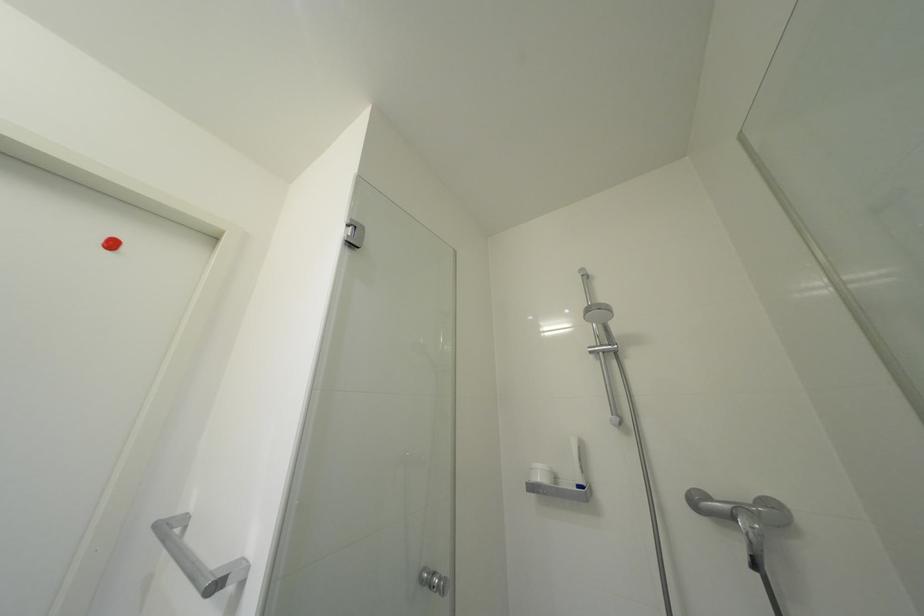
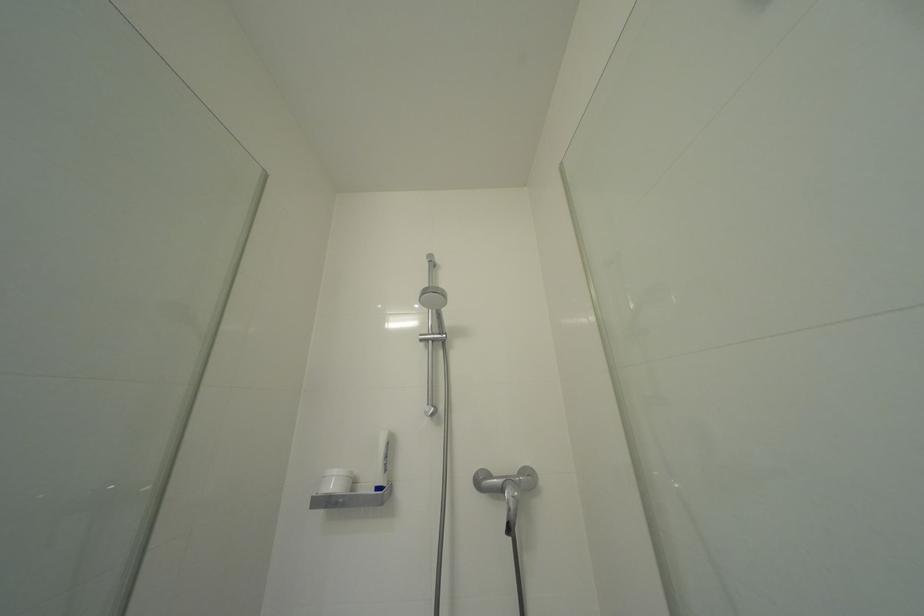
Question: The images are taken continuously from a first-person perspective. In which direction is your viewpoint rotating?

Choices:
 (A) Left
 (B) Right
 (C) Up
 (D) Down

Answer: (B)